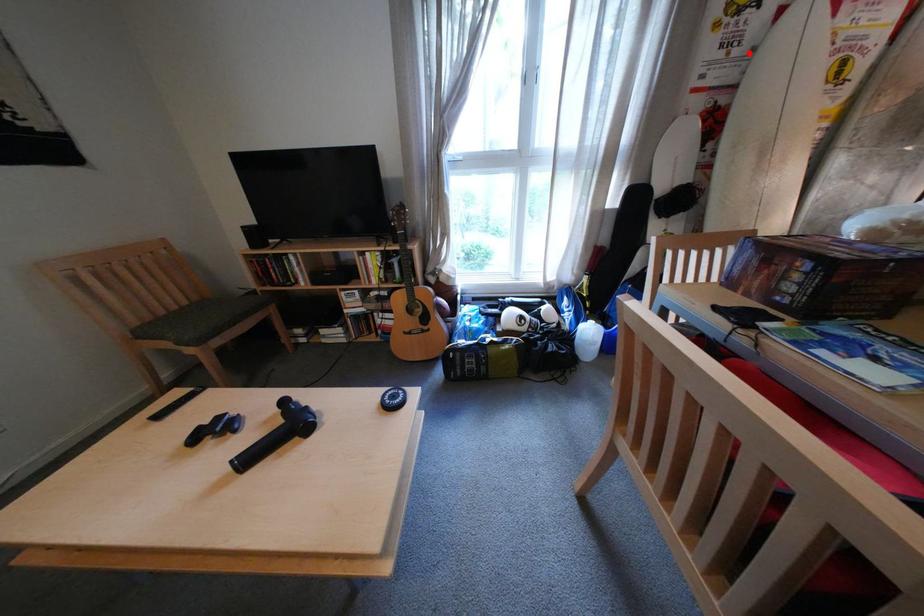
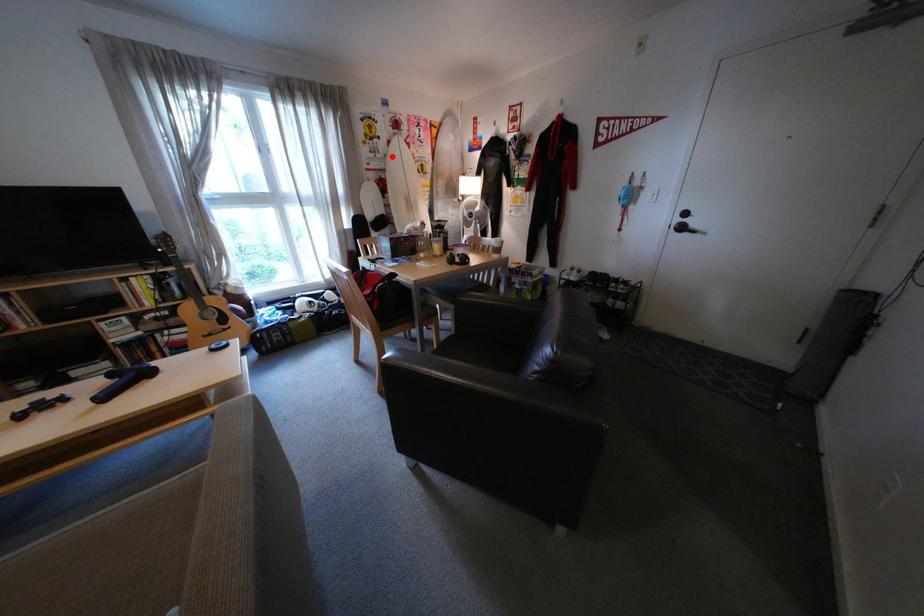
I am providing you with two images of the same scene from different viewpoints. A red point is marked on the first image and another point is marked on the second image. Does the point marked in image1 correspond to the same location as the one in image2?

Yes